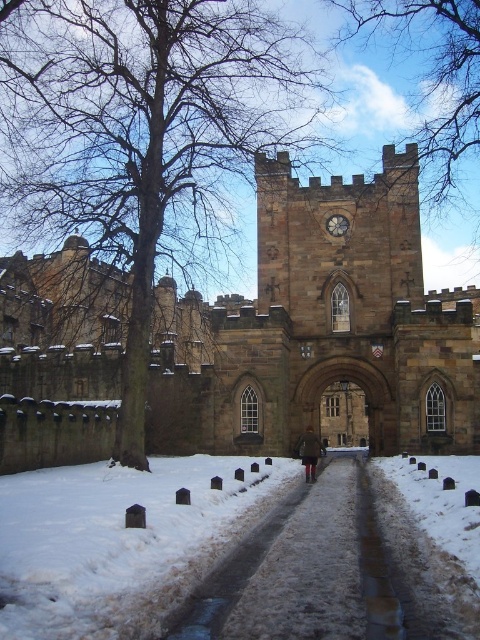
Question: Does brown leafless tree at center appear over bare branches at upper center?

Choices:
 (A) yes
 (B) no

Answer: (B)

Question: Which object appears farthest from the camera in this image?

Choices:
 (A) brown leafless tree at center
 (B) bare branches at upper center

Answer: (B)

Question: Can you confirm if brown leafless tree at center is wider than bare branches at upper center?

Choices:
 (A) no
 (B) yes

Answer: (B)

Question: Can you confirm if brown leafless tree at center is smaller than bare branches at upper center?

Choices:
 (A) yes
 (B) no

Answer: (B)

Question: Which of the following is the closest to the observer?

Choices:
 (A) brown leafless tree at center
 (B) bare branches at upper center

Answer: (A)